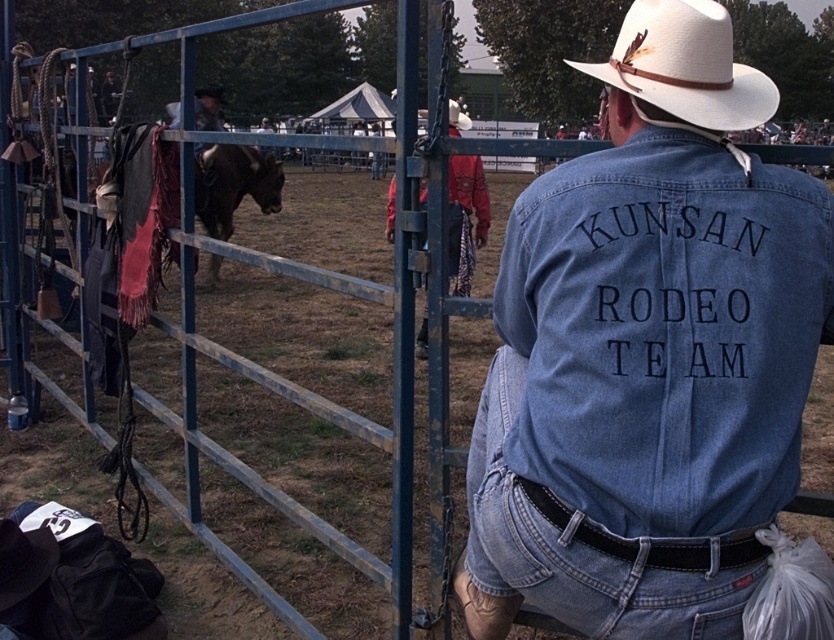
Can you confirm if denim jacket at center is smaller than denim at back?

No, denim jacket at center is not smaller than denim at back.

Locate an element on the screen. The height and width of the screenshot is (640, 834). denim jacket at center is located at coordinates (649, 353).

Who is more forward, (x=697, y=365) or (x=525, y=564)?

Point (x=697, y=365) is in front.

This screenshot has width=834, height=640. Find the location of `denim jacket at center`. denim jacket at center is located at coordinates (649, 353).

Is denim jacket at center shorter than brown leather horse at center?

Yes.

Is denim jacket at center closer to the viewer compared to brown leather horse at center?

Yes.

Identify the location of denim jacket at center. Image resolution: width=834 pixels, height=640 pixels. (649, 353).

Between natural straw cowboy hat at upper center and brown leather horse at center, which one appears on the right side from the viewer's perspective?

natural straw cowboy hat at upper center is more to the right.

Which is more to the left, natural straw cowboy hat at upper center or brown leather horse at center?

brown leather horse at center is more to the left.

Describe the element at coordinates (686, 65) in the screenshot. I see `natural straw cowboy hat at upper center` at that location.

I want to click on natural straw cowboy hat at upper center, so click(686, 65).